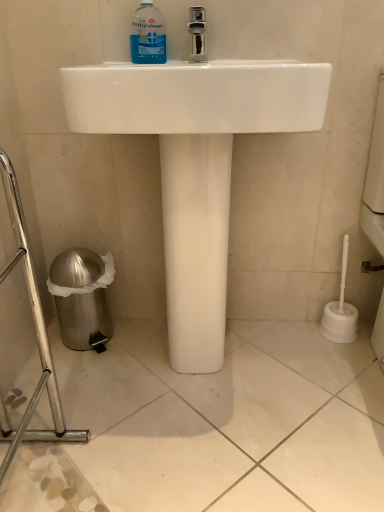
Question: Does blue transparent liquid at upper center turn towards white glossy sink at center?

Choices:
 (A) yes
 (B) no

Answer: (A)

Question: Can you confirm if blue transparent liquid at upper center is taller than white glossy sink at center?

Choices:
 (A) yes
 (B) no

Answer: (B)

Question: Is blue transparent liquid at upper center turned away from white glossy sink at center?

Choices:
 (A) no
 (B) yes

Answer: (B)

Question: Is blue transparent liquid at upper center with white glossy sink at center?

Choices:
 (A) yes
 (B) no

Answer: (B)

Question: Can you confirm if blue transparent liquid at upper center is wider than white glossy sink at center?

Choices:
 (A) yes
 (B) no

Answer: (B)

Question: Does blue transparent liquid at upper center appear on the left side of white glossy sink at center?

Choices:
 (A) yes
 (B) no

Answer: (A)

Question: Does white glossy sink at center appear on the right side of blue transparent liquid at upper center?

Choices:
 (A) yes
 (B) no

Answer: (A)

Question: From a real-world perspective, is white glossy sink at center located beneath blue transparent liquid at upper center?

Choices:
 (A) yes
 (B) no

Answer: (A)

Question: Does white glossy sink at center have a lesser width compared to blue transparent liquid at upper center?

Choices:
 (A) yes
 (B) no

Answer: (B)

Question: Is white glossy sink at center facing towards blue transparent liquid at upper center?

Choices:
 (A) no
 (B) yes

Answer: (A)

Question: Is white glossy sink at center shorter than blue transparent liquid at upper center?

Choices:
 (A) no
 (B) yes

Answer: (A)

Question: From the image's perspective, is white glossy sink at center on top of blue transparent liquid at upper center?

Choices:
 (A) no
 (B) yes

Answer: (A)

Question: Considering the positions of point (155, 60) and point (168, 261), is point (155, 60) closer or farther from the camera than point (168, 261)?

Choices:
 (A) farther
 (B) closer

Answer: (B)